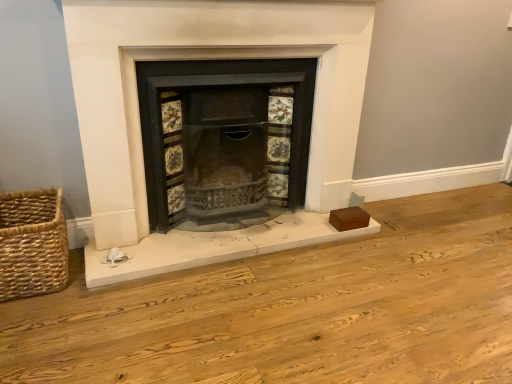
The width and height of the screenshot is (512, 384). I want to click on vacant point to the right of matte black fireplace at center, so click(x=411, y=255).